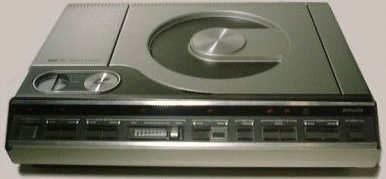
I want to click on black switch, so click(x=245, y=136).